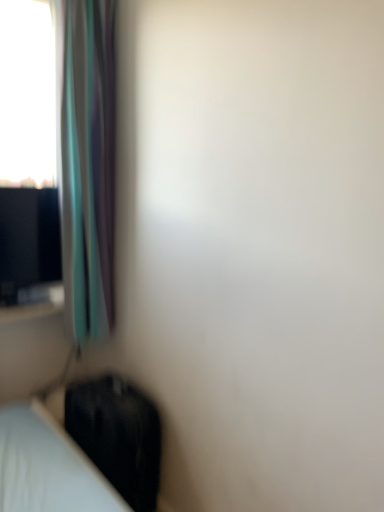
Question: Should I look upward or downward to see translucent fabric curtain at left?

Choices:
 (A) down
 (B) up

Answer: (B)

Question: Is black fabric luggage at lower left to the left of translucent fabric curtain at left from the viewer's perspective?

Choices:
 (A) yes
 (B) no

Answer: (B)

Question: Is black fabric luggage at lower left at the right side of translucent fabric curtain at left?

Choices:
 (A) yes
 (B) no

Answer: (A)

Question: Does black fabric luggage at lower left come behind translucent fabric curtain at left?

Choices:
 (A) yes
 (B) no

Answer: (A)

Question: Does black fabric luggage at lower left have a larger size compared to translucent fabric curtain at left?

Choices:
 (A) no
 (B) yes

Answer: (A)

Question: Is black fabric luggage at lower left taller than translucent fabric curtain at left?

Choices:
 (A) yes
 (B) no

Answer: (B)

Question: Would you consider black fabric luggage at lower left to be distant from translucent fabric curtain at left?

Choices:
 (A) no
 (B) yes

Answer: (A)

Question: Is translucent fabric curtain at left beside black fabric luggage at lower left?

Choices:
 (A) no
 (B) yes

Answer: (A)

Question: Does translucent fabric curtain at left have a lesser height compared to black fabric luggage at lower left?

Choices:
 (A) no
 (B) yes

Answer: (A)

Question: Is translucent fabric curtain at left turned away from black fabric luggage at lower left?

Choices:
 (A) yes
 (B) no

Answer: (B)

Question: Is translucent fabric curtain at left positioned behind black fabric luggage at lower left?

Choices:
 (A) no
 (B) yes

Answer: (A)

Question: Is translucent fabric curtain at left facing towards black fabric luggage at lower left?

Choices:
 (A) no
 (B) yes

Answer: (A)

Question: Does translucent fabric curtain at left come in front of black fabric luggage at lower left?

Choices:
 (A) no
 (B) yes

Answer: (B)

Question: In the image, is translucent fabric curtain at left on the left side or the right side of black fabric luggage at lower left?

Choices:
 (A) left
 (B) right

Answer: (A)